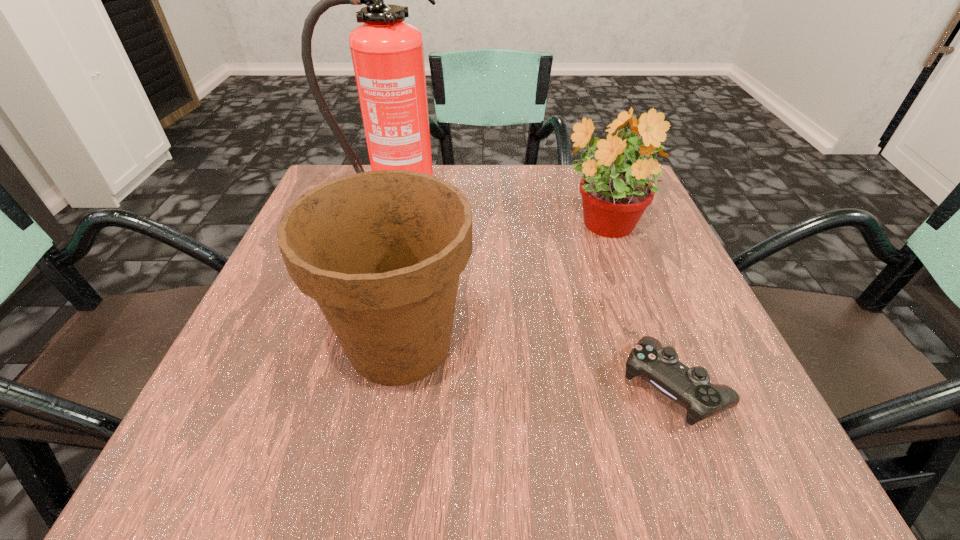
I want to click on the tallest object, so click(x=387, y=53).

Identify the location of the farther flowerpot. The width and height of the screenshot is (960, 540). (615, 194).

Identify the location of the left flowerpot. Image resolution: width=960 pixels, height=540 pixels. (381, 252).

Identify the location of the shortest object. (689, 387).

You are a GUI agent. You are given a task and a screenshot of the screen. Output one action in this format:
    pyautogui.click(x=<x>, y=<y>)
    Task: Click on the vacant space located 0.340m at the nozzle of the fire extinguisher
    Image resolution: width=960 pixels, height=540 pixels.
    Given the screenshot: What is the action you would take?
    pyautogui.click(x=354, y=353)

At what (x,y) coordinates should I click in order to perform the action: click on free space located on the front of the farther flowerpot. Please return your answer as a coordinate pair (x, y). The image size is (960, 540). Looking at the image, I should click on (644, 349).

Find the location of a particular element. The image size is (960, 540). free space located on the right of the left flowerpot is located at coordinates (678, 344).

Locate an element on the screen. blank space located on the left of the shortest object is located at coordinates (545, 386).

Identify the location of fire extinguisher present at the far edge. This screenshot has height=540, width=960. (387, 53).

At what (x,y) coordinates should I click in order to perform the action: click on flowerpot that is at the far edge. Please return your answer as a coordinate pair (x, y). The width and height of the screenshot is (960, 540). Looking at the image, I should click on (615, 194).